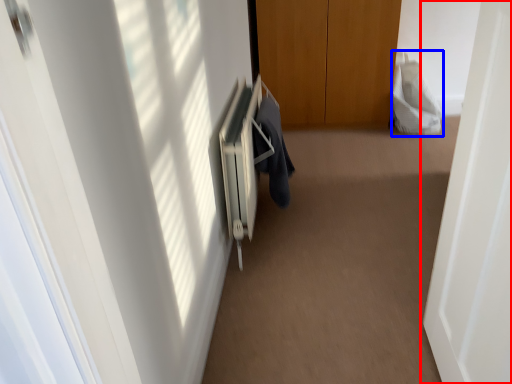
Question: Among these objects, which one is nearest to the camera, door (highlighted by a red box) or robe (highlighted by a blue box)?

Choices:
 (A) door
 (B) robe

Answer: (A)